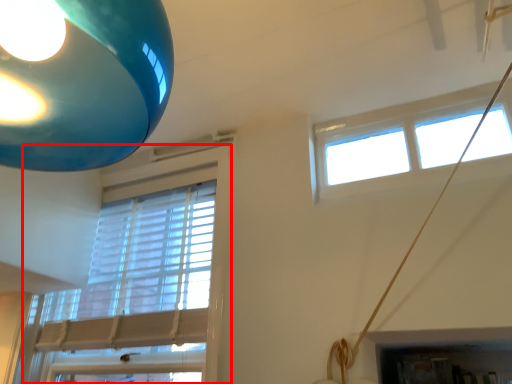
Question: Where is window (annotated by the red box) located in relation to window in the image?

Choices:
 (A) right
 (B) left

Answer: (B)